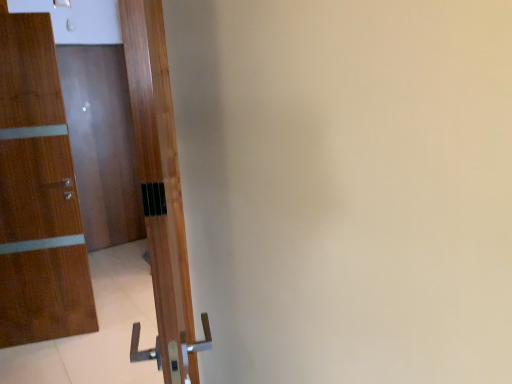
Where is `free point above glossy wood door at left, which is counted as the 3th door, starting from the front (from a real-world perspective)`? The width and height of the screenshot is (512, 384). free point above glossy wood door at left, which is counted as the 3th door, starting from the front (from a real-world perspective) is located at coordinates (93, 43).